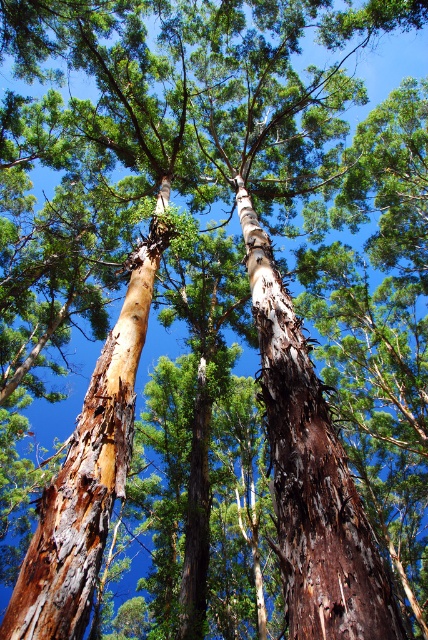
Question: Considering the relative positions of brown rough bark at center and brown rough bark at left in the image provided, where is brown rough bark at center located with respect to brown rough bark at left?

Choices:
 (A) left
 (B) right

Answer: (B)

Question: Which point is closer to the camera taking this photo?

Choices:
 (A) (101, 381)
 (B) (318, 512)

Answer: (B)

Question: Which of the following is the farthest from the observer?

Choices:
 (A) (41, 536)
 (B) (345, 636)

Answer: (A)

Question: Where is brown rough bark at center located in relation to brown rough bark at left in the image?

Choices:
 (A) below
 (B) above

Answer: (A)

Question: Which point is closer to the camera?

Choices:
 (A) (302, 412)
 (B) (70, 552)

Answer: (B)

Question: Observing the image, what is the correct spatial positioning of brown rough bark at center in reference to brown rough bark at left?

Choices:
 (A) right
 (B) left

Answer: (A)